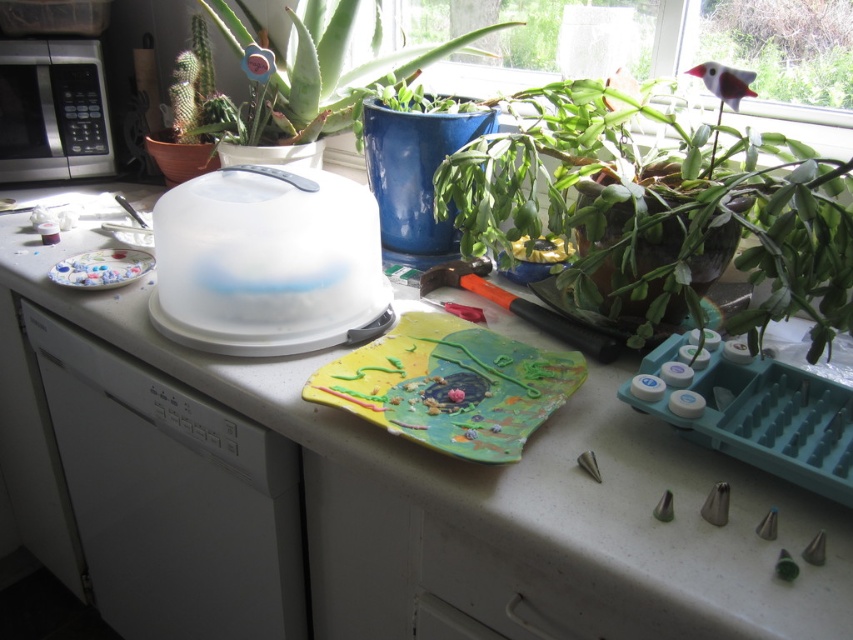
You are standing at the center of the kitchen counter. Where is the silver metallic microwave at left located relative to your position?

The silver metallic microwave at left is located at the left side of the counter, to the left of your current position at the center.

You are organizing the kitchen counter and need to place a large bowl that requires a surface area of 300 square centimeters. Which object between the white plastic tray at center and the green matte aloe vera at upper center would be more suitable for placing the bowl?

The white plastic tray at center has a larger size compared to the green matte aloe vera at upper center, so it would be more suitable for placing the large bowl requiring 300 square centimeters of surface area.

You are a photographer standing at the edge of the kitchen counter. You want to take a closeup photo of the leathery green plant at center right. The camera you are using has a minimum focusing distance of 50 centimeters. Can you take the photo without moving the plant?

The leathery green plant at center right is 71.48 centimeters from camera, which is beyond the minimum focusing distance of 50 centimeters. Therefore, you can take the closeup photo without moving the plant.